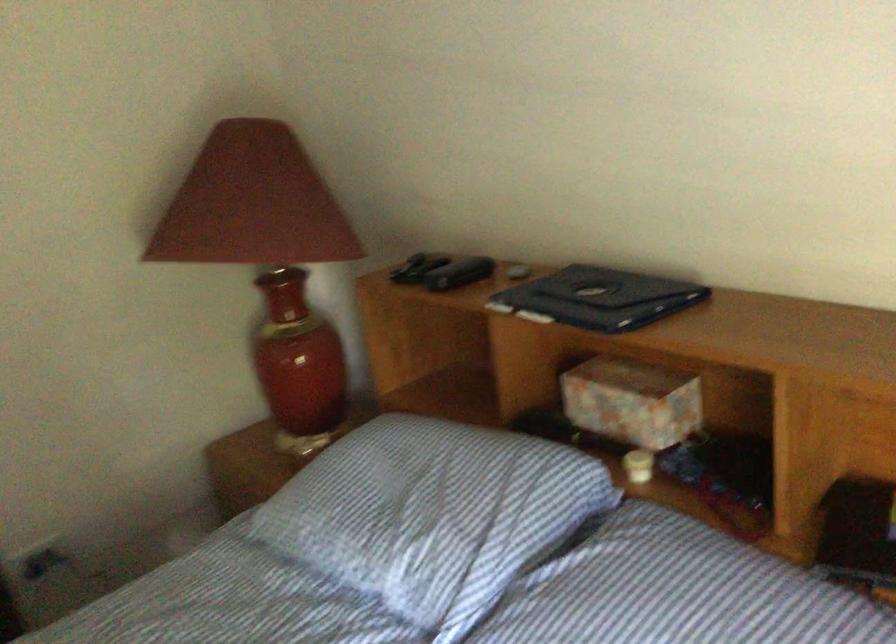
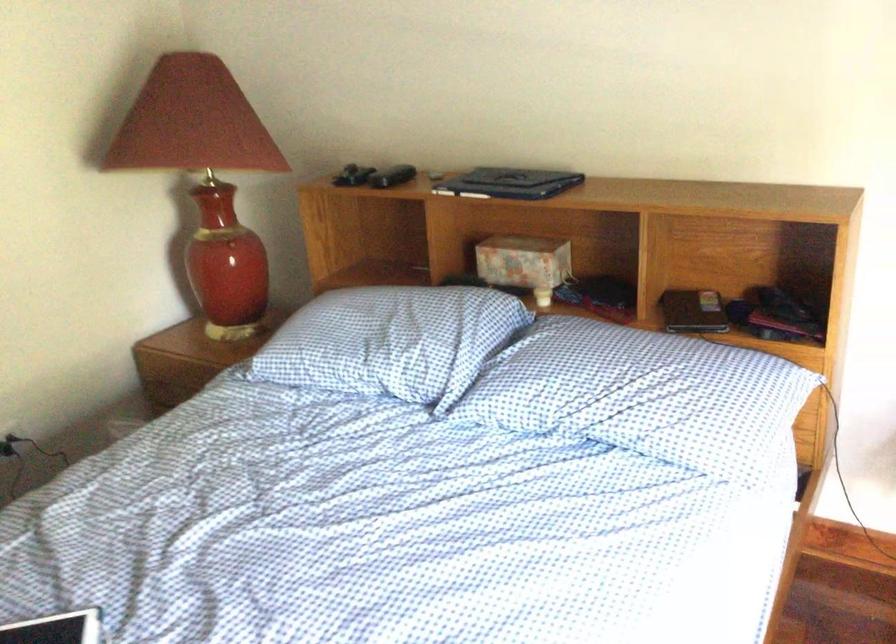
Where in the second image is the point corresponding to the point at 418,272 from the first image?

(352, 176)